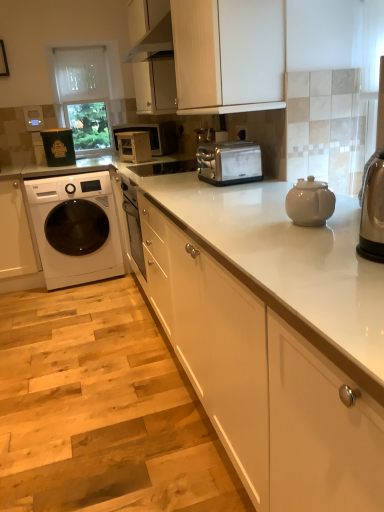
From the picture: Measure the distance between matte black container at left, the 2th appliance positioned from the right, and camera.

matte black container at left, the 2th appliance positioned from the right, and camera are 3.21 meters apart from each other.

I want to click on matte black container at left, which appears as the first appliance when viewed from the left, so click(58, 147).

Describe the element at coordinates (264, 383) in the screenshot. The height and width of the screenshot is (512, 384). I see `white glossy cabinet at center, acting as the third cabinetry starting from the left` at that location.

This screenshot has height=512, width=384. What do you see at coordinates (76, 228) in the screenshot?
I see `white glossy washing machine at left` at bounding box center [76, 228].

The height and width of the screenshot is (512, 384). In order to click on white glossy cabinet at left, positioned as the third cabinetry in right-to-left order in this screenshot , I will do click(14, 233).

What do you see at coordinates (228, 53) in the screenshot? This screenshot has height=512, width=384. I see `white matte cabinet at upper center, arranged as the 2th cabinetry when viewed from the left` at bounding box center [228, 53].

Locate an element on the screen. satin silver microwave at center, the 2th appliance in the left-to-right sequence is located at coordinates (134, 146).

Does white glossy cabinet at center, arranged as the 1th cabinetry when viewed from the right, come behind matte white microwave at center?

That is False.

From the image's perspective, is white glossy cabinet at center, acting as the third cabinetry starting from the left, positioned above or below matte white microwave at center?

Based on their image positions, white glossy cabinet at center, acting as the third cabinetry starting from the left, is located beneath matte white microwave at center.

In terms of width, does white glossy cabinet at center, acting as the third cabinetry starting from the left, look wider or thinner when compared to matte white microwave at center?

white glossy cabinet at center, acting as the third cabinetry starting from the left, is wider than matte white microwave at center.

Between white glossy cabinet at left, marked as the first cabinetry in a left-to-right arrangement, and matte black container at left, the 2th appliance positioned from the right, which one has larger width?

Wider between the two is white glossy cabinet at left, marked as the first cabinetry in a left-to-right arrangement.

Does white glossy cabinet at left, positioned as the third cabinetry in right-to-left order, have a larger size compared to matte black container at left, the 2th appliance positioned from the right?

Indeed, white glossy cabinet at left, positioned as the third cabinetry in right-to-left order, has a larger size compared to matte black container at left, the 2th appliance positioned from the right.

Is white glossy cabinet at left, marked as the first cabinetry in a left-to-right arrangement, taller than matte black container at left, which appears as the first appliance when viewed from the left?

Correct, white glossy cabinet at left, marked as the first cabinetry in a left-to-right arrangement, is much taller as matte black container at left, which appears as the first appliance when viewed from the left.

From the image's perspective, would you say white matte cabinet at upper center, the 2th cabinetry in the right-to-left sequence, is shown under white glossy cabinet at center, arranged as the 1th cabinetry when viewed from the right?

Actually, white matte cabinet at upper center, the 2th cabinetry in the right-to-left sequence, appears above white glossy cabinet at center, arranged as the 1th cabinetry when viewed from the right, in the image.

From a real-world perspective, is white matte cabinet at upper center, arranged as the 2th cabinetry when viewed from the left, physically located above or below white glossy cabinet at center, arranged as the 1th cabinetry when viewed from the right?

white matte cabinet at upper center, arranged as the 2th cabinetry when viewed from the left, is above white glossy cabinet at center, arranged as the 1th cabinetry when viewed from the right.

Is white matte cabinet at upper center, the 2th cabinetry in the right-to-left sequence, positioned with its back to white glossy cabinet at center, arranged as the 1th cabinetry when viewed from the right?

That's not correct — white matte cabinet at upper center, the 2th cabinetry in the right-to-left sequence, is not looking away from white glossy cabinet at center, arranged as the 1th cabinetry when viewed from the right.

Between white glossy washing machine at left and transparent glass door at upper center, the 2th glass door when ordered from top to bottom, which one appears on the right side from the viewer's perspective?

Positioned to the right is white glossy washing machine at left.

From the image's perspective, which object appears higher, white glossy washing machine at left or transparent glass door at upper center, acting as the 1th glass door starting from the bottom?

transparent glass door at upper center, acting as the 1th glass door starting from the bottom, appears higher in the image.

From a real-world perspective, who is located lower, white glossy washing machine at left or transparent glass door at upper center, acting as the 1th glass door starting from the bottom?

In real-world perspective, white glossy washing machine at left is lower.

From the image's perspective, would you say white glossy washing machine at left is shown under matte white microwave at center?

Yes, from the image's perspective, white glossy washing machine at left is beneath matte white microwave at center.

Looking at this image, can you confirm if white glossy washing machine at left is thinner than matte white microwave at center?

In fact, white glossy washing machine at left might be wider than matte white microwave at center.

Considering the relative sizes of white glossy washing machine at left and matte white microwave at center in the image provided, is white glossy washing machine at left smaller than matte white microwave at center?

Incorrect, white glossy washing machine at left is not smaller in size than matte white microwave at center.

How far apart are transparent glass door at upper center, acting as the 1th glass door starting from the bottom, and white glossy cabinet at left, positioned as the third cabinetry in right-to-left order?

transparent glass door at upper center, acting as the 1th glass door starting from the bottom, and white glossy cabinet at left, positioned as the third cabinetry in right-to-left order, are 1.12 meters apart from each other.

Can you confirm if transparent glass door at upper center, the 2th glass door when ordered from top to bottom, is wider than white glossy cabinet at left, positioned as the third cabinetry in right-to-left order?

No.

Identify the location of cabinetry located on the left of transparent glass door at upper center, the 2th glass door when ordered from top to bottom. (14, 233).

Does point (67, 100) appear closer or farther from the camera than point (20, 262)?

Point (67, 100).

From a real-world perspective, is matte white microwave at center above or below white glossy cabinet at center, acting as the third cabinetry starting from the left?

From a real-world perspective, matte white microwave at center is physically above white glossy cabinet at center, acting as the third cabinetry starting from the left.

Would you say matte white microwave at center is a long distance from white glossy cabinet at center, acting as the third cabinetry starting from the left?

Indeed, matte white microwave at center is not near white glossy cabinet at center, acting as the third cabinetry starting from the left.

Considering the sizes of matte white microwave at center and white glossy cabinet at center, acting as the third cabinetry starting from the left, in the image, is matte white microwave at center wider or thinner than white glossy cabinet at center, acting as the third cabinetry starting from the left,?

In the image, matte white microwave at center appears to be more narrow than white glossy cabinet at center, acting as the third cabinetry starting from the left.

Relative to white glossy cabinet at center, acting as the third cabinetry starting from the left, is matte white microwave at center in front or behind?

matte white microwave at center is positioned farther from the viewer than white glossy cabinet at center, acting as the third cabinetry starting from the left.

The image size is (384, 512). I want to click on microwave oven above the white glossy cabinet at center, acting as the third cabinetry starting from the left (from a real-world perspective), so click(153, 136).

Image resolution: width=384 pixels, height=512 pixels. What are the coordinates of `cabinetry on the left of matte black container at left, which appears as the first appliance when viewed from the left` in the screenshot? It's located at (14, 233).

When comparing their distances from white matte cabinet at upper center, arranged as the 2th cabinetry when viewed from the left, does white glossy washing machine at left or white glossy cabinet at center, acting as the third cabinetry starting from the left, seem further?

The object further to white matte cabinet at upper center, arranged as the 2th cabinetry when viewed from the left, is white glossy washing machine at left.

Considering their positions, is white glossy cabinet at center, arranged as the 1th cabinetry when viewed from the right, positioned closer to satin silver microwave at center, the first appliance viewed from the right, than white glossy washing machine at left?

Based on the image, white glossy washing machine at left appears to be nearer to satin silver microwave at center, the first appliance viewed from the right.

From the image, which object appears to be nearer to satin silver toaster at center, white glossy cabinet at center, arranged as the 1th cabinetry when viewed from the right, or transparent glass door at upper center, which is the 1th glass door in top-to-bottom order?

white glossy cabinet at center, arranged as the 1th cabinetry when viewed from the right, lies closer to satin silver toaster at center than the other object.

Based on their spatial positions, is white glossy washing machine at left or white matte cabinet at upper center, arranged as the 2th cabinetry when viewed from the left, closer to transparent glass door at upper center, acting as the 1th glass door starting from the bottom?

white glossy washing machine at left is closer to transparent glass door at upper center, acting as the 1th glass door starting from the bottom.

Which object lies nearer to the anchor point white glossy cabinet at center, arranged as the 1th cabinetry when viewed from the right, satin silver microwave at center, the first appliance viewed from the right, or transparent glass door at upper center, which is the 1th glass door in top-to-bottom order?

The object closer to white glossy cabinet at center, arranged as the 1th cabinetry when viewed from the right, is satin silver microwave at center, the first appliance viewed from the right.

Estimate the real-world distances between objects in this image. Which object is further from white glossy cabinet at left, marked as the first cabinetry in a left-to-right arrangement, matte white microwave at center or satin silver toaster at center?

satin silver toaster at center.

Which object lies further to the anchor point transparent glass door at upper center, which is the 1th glass door in top-to-bottom order, white matte cabinet at upper center, arranged as the 2th cabinetry when viewed from the left, or white glossy cabinet at left, positioned as the third cabinetry in right-to-left order?

white matte cabinet at upper center, arranged as the 2th cabinetry when viewed from the left, is further to transparent glass door at upper center, which is the 1th glass door in top-to-bottom order.

Looking at the image, which one is located further to white glossy cabinet at left, positioned as the third cabinetry in right-to-left order, transparent glass door at upper center, which appears as the 2th glass door when ordered from the bottom, or transparent glass door at upper center, the 2th glass door when ordered from top to bottom?

transparent glass door at upper center, which appears as the 2th glass door when ordered from the bottom, lies further to white glossy cabinet at left, positioned as the third cabinetry in right-to-left order, than the other object.

The image size is (384, 512). I want to click on washing machine between white glossy cabinet at center, arranged as the 1th cabinetry when viewed from the right, and matte white microwave at center from front to back, so click(76, 228).

Identify the location of microwave oven that lies between transparent glass door at upper center, acting as the 1th glass door starting from the bottom, and white glossy washing machine at left from top to bottom. This screenshot has height=512, width=384. (153, 136).

Locate an element on the screen. glass door that lies between transparent glass door at upper center, which is the 1th glass door in top-to-bottom order, and matte black container at left, which appears as the first appliance when viewed from the left, from top to bottom is located at coordinates (84, 95).

The image size is (384, 512). Find the location of `toaster between white matte cabinet at upper center, the 2th cabinetry in the right-to-left sequence, and satin silver microwave at center, the 2th appliance in the left-to-right sequence, in the front-back direction`. toaster between white matte cabinet at upper center, the 2th cabinetry in the right-to-left sequence, and satin silver microwave at center, the 2th appliance in the left-to-right sequence, in the front-back direction is located at coordinates (229, 163).